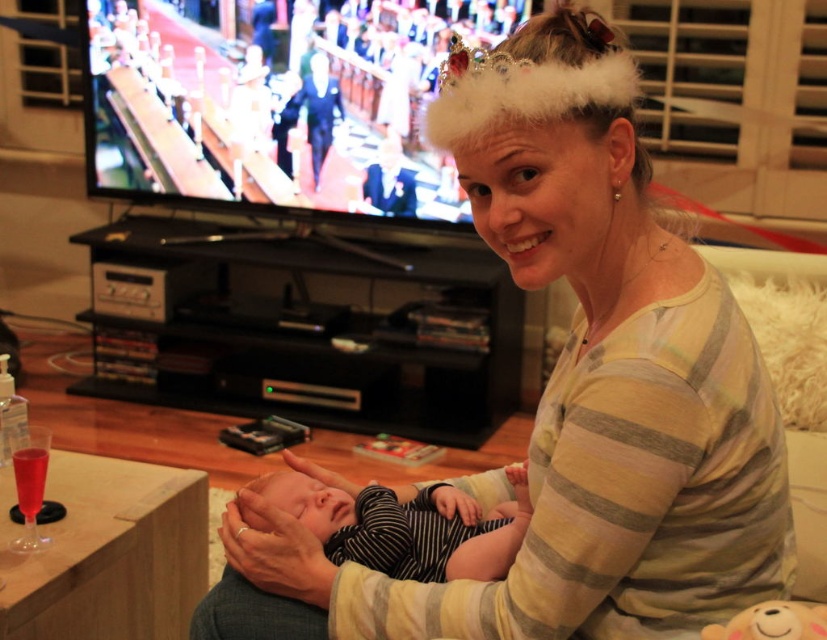
Question: Among these objects, which one is nearest to the camera?

Choices:
 (A) black striped onesie at center
 (B) striped cotton shirt at center
 (C) fluffy plush bear at lower right

Answer: (C)

Question: Estimate the real-world distances between objects in this image. Which object is farther from the black striped onesie at center?

Choices:
 (A) striped cotton shirt at center
 (B) fluffy plush bear at lower right

Answer: (B)

Question: Observing the image, what is the correct spatial positioning of striped cotton shirt at center in reference to fluffy plush bear at lower right?

Choices:
 (A) above
 (B) below

Answer: (A)

Question: Is black striped onesie at center bigger than fluffy plush bear at lower right?

Choices:
 (A) yes
 (B) no

Answer: (A)

Question: Is striped cotton shirt at center below black striped onesie at center?

Choices:
 (A) yes
 (B) no

Answer: (B)

Question: Which of the following is the farthest from the observer?

Choices:
 (A) (543, 556)
 (B) (410, 538)

Answer: (B)